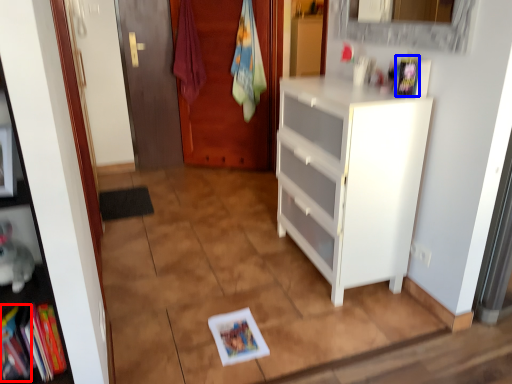
Question: Which object is closer to the camera taking this photo, book (highlighted by a red box) or book (highlighted by a blue box)?

Choices:
 (A) book
 (B) book

Answer: (A)